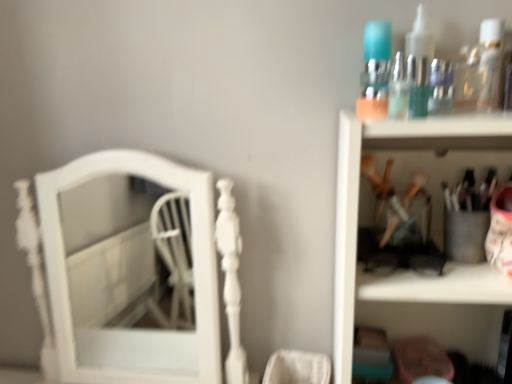
Identify the location of metallic silver utensils at upper right. The width and height of the screenshot is (512, 384). (410, 271).

In order to face clear plastic bottle at upper right, should I rotate leftwards or rightwards?

It's best to rotate right around 31.078 degrees.

The width and height of the screenshot is (512, 384). Find the location of `metallic silver utensils at upper right`. metallic silver utensils at upper right is located at coordinates (410, 271).

How much distance is there between clear plastic bottle at upper right and metallic silver utensils at upper right?

They are 11.36 inches apart.

Is clear plastic bottle at upper right turned away from metallic silver utensils at upper right?

That's not correct — clear plastic bottle at upper right is not looking away from metallic silver utensils at upper right.

Is clear plastic bottle at upper right bigger than metallic silver utensils at upper right?

Actually, clear plastic bottle at upper right might be smaller than metallic silver utensils at upper right.

Is point (485, 97) positioned behind point (452, 280)?

Yes, point (485, 97) is farther from viewer.

Which object is positioned more to the right, clear plastic bottle at upper right or translucent glass bottles at upper right?

Positioned to the right is clear plastic bottle at upper right.

Based on the photo, could you tell me if clear plastic bottle at upper right is facing translucent glass bottles at upper right?

No, clear plastic bottle at upper right is not oriented towards translucent glass bottles at upper right.

Does point (484, 64) come in front of point (445, 91)?

No, (484, 64) is further to viewer.

Is translucent glass bottles at upper right inside clear plastic bottle at upper right?

No, translucent glass bottles at upper right is not inside clear plastic bottle at upper right.

Can you tell me how much metallic silver utensils at upper right and translucent glass bottles at upper right differ in facing direction?

metallic silver utensils at upper right and translucent glass bottles at upper right are facing 0.0017 degrees away from each other.

Consider the image. Which is farther, (343, 265) or (473, 82)?

The point (473, 82) is behind.

From their relative heights in the image, would you say metallic silver utensils at upper right is taller or shorter than translucent glass bottles at upper right?

In the image, metallic silver utensils at upper right appears to be taller than translucent glass bottles at upper right.

Is metallic silver utensils at upper right in front of or behind translucent glass bottles at upper right in the image?

In the image, metallic silver utensils at upper right appears in front of translucent glass bottles at upper right.

From the picture: Is white glossy mirror at left at the right side of metallic silver utensils at upper right?

No.

How many degrees apart are the facing directions of white glossy mirror at left and metallic silver utensils at upper right?

The facing directions of white glossy mirror at left and metallic silver utensils at upper right are 0.605 degrees apart.

Could you tell me if white glossy mirror at left is turned towards metallic silver utensils at upper right?

No, white glossy mirror at left is not oriented towards metallic silver utensils at upper right.

Choose the correct answer: Is white glossy mirror at left inside metallic silver utensils at upper right or outside it?

white glossy mirror at left is outside metallic silver utensils at upper right.

Can you see clear plastic bottle at upper right touching white glossy mirror at left?

No, clear plastic bottle at upper right is not next to white glossy mirror at left.

Can you confirm if clear plastic bottle at upper right is wider than white glossy mirror at left?

Incorrect, the width of clear plastic bottle at upper right does not surpass that of white glossy mirror at left.

Where is `furniture on the left of the clear plastic bottle at upper right`? furniture on the left of the clear plastic bottle at upper right is located at coordinates (124, 269).

From the image's perspective, is metallic silver utensils at upper right beneath clear plastic bottle at upper right?

Yes.

At what (x,y) coordinates should I click in order to perform the action: click on shelf that is on the left side of clear plastic bottle at upper right. Please return your answer as a coordinate pair (x, y). Looking at the image, I should click on (410, 271).

From a real-world perspective, is metallic silver utensils at upper right physically below clear plastic bottle at upper right?

Yes, from a real-world perspective, metallic silver utensils at upper right is below clear plastic bottle at upper right.

Is clear plastic bottle at upper right at the back of metallic silver utensils at upper right?

No, metallic silver utensils at upper right's orientation is not away from clear plastic bottle at upper right.

Can you confirm if white glossy mirror at left is smaller than clear plastic bottle at upper right?

No.

Is clear plastic bottle at upper right located within white glossy mirror at left?

No, clear plastic bottle at upper right is not inside white glossy mirror at left.

Is white glossy mirror at left next to clear plastic bottle at upper right and touching it?

No, white glossy mirror at left is not touching clear plastic bottle at upper right.

At what (x,y) coordinates should I click in order to perform the action: click on mouthwash above the metallic silver utensils at upper right (from a real-world perspective). Please return your answer as a coordinate pair (x, y). This screenshot has width=512, height=384. Looking at the image, I should click on (485, 66).

Image resolution: width=512 pixels, height=384 pixels. I want to click on mouthwash beneath the translucent glass bottles at upper right (from a real-world perspective), so click(x=485, y=66).

Estimate the real-world distances between objects in this image. Which object is further from white glossy mirror at left, clear plastic bottle at upper right or metallic silver utensils at upper right?

clear plastic bottle at upper right lies further to white glossy mirror at left than the other object.

Based on their spatial positions, is white glossy mirror at left or translucent glass bottles at upper right closer to clear plastic bottle at upper right?

The object closer to clear plastic bottle at upper right is translucent glass bottles at upper right.

Which object lies further to the anchor point translucent glass bottles at upper right, clear plastic bottle at upper right or white glossy mirror at left?

Among the two, white glossy mirror at left is located further to translucent glass bottles at upper right.

Looking at this image, when comparing their distances from clear plastic bottle at upper right, does translucent glass bottles at upper right or metallic silver utensils at upper right seem further?

The object further to clear plastic bottle at upper right is metallic silver utensils at upper right.

From the image, which object appears to be nearer to clear plastic bottle at upper right, metallic silver utensils at upper right or white glossy mirror at left?

metallic silver utensils at upper right lies closer to clear plastic bottle at upper right than the other object.

Estimate the real-world distances between objects in this image. Which object is further from metallic silver utensils at upper right, clear plastic bottle at upper right or white glossy mirror at left?

Based on the image, white glossy mirror at left appears to be further to metallic silver utensils at upper right.

Which object lies further to the anchor point translucent glass bottles at upper right, metallic silver utensils at upper right or clear plastic bottle at upper right?

Among the two, metallic silver utensils at upper right is located further to translucent glass bottles at upper right.

Based on their spatial positions, is white glossy mirror at left or clear plastic bottle at upper right closer to metallic silver utensils at upper right?

clear plastic bottle at upper right lies closer to metallic silver utensils at upper right than the other object.

At what (x,y) coordinates should I click in order to perform the action: click on collection between white glossy mirror at left and metallic silver utensils at upper right from left to right. Please return your answer as a coordinate pair (x, y). The image size is (512, 384). Looking at the image, I should click on (392, 66).

You are a GUI agent. You are given a task and a screenshot of the screen. Output one action in this format:
    pyautogui.click(x=<x>, y=<y>)
    Task: Click on the collection between white glossy mirror at left and clear plastic bottle at upper right
    
    Given the screenshot: What is the action you would take?
    pyautogui.click(x=392, y=66)

You are a GUI agent. You are given a task and a screenshot of the screen. Output one action in this format:
    pyautogui.click(x=<x>, y=<y>)
    Task: Click on the collection between clear plastic bottle at upper right and metallic silver utensils at upper right in the up-down direction
    The width and height of the screenshot is (512, 384).
    Given the screenshot: What is the action you would take?
    pyautogui.click(x=392, y=66)

Where is `shelf between white glossy mirror at left and clear plastic bottle at upper right`? Image resolution: width=512 pixels, height=384 pixels. shelf between white glossy mirror at left and clear plastic bottle at upper right is located at coordinates (410, 271).